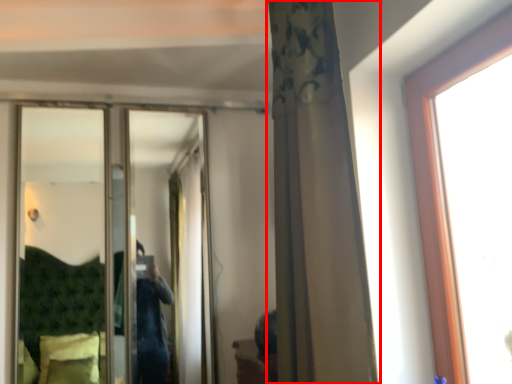
Question: Considering the relative positions of curtain (annotated by the red box) and mirror in the image provided, where is curtain (annotated by the red box) located with respect to the staircase?

Choices:
 (A) left
 (B) right

Answer: (B)